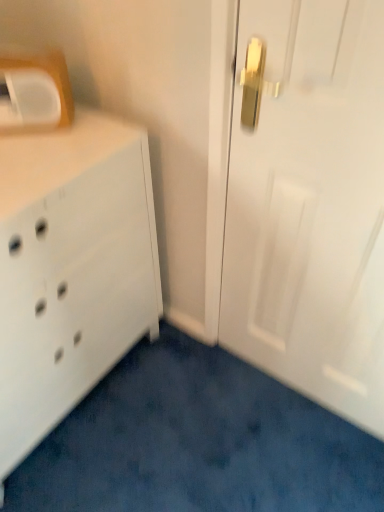
You are a GUI agent. You are given a task and a screenshot of the screen. Output one action in this format:
    pyautogui.click(x=<x>, y=<y>)
    Task: Click on the white plastic medicine cabinet at upper left
    The height and width of the screenshot is (512, 384).
    Given the screenshot: What is the action you would take?
    pyautogui.click(x=35, y=93)

At what (x,y) coordinates should I click in order to perform the action: click on white matte chest of drawers at left. Please return your answer as a coordinate pair (x, y). The image size is (384, 512). Looking at the image, I should click on (71, 269).

Image resolution: width=384 pixels, height=512 pixels. What are the coordinates of `door that is in front of the white matte chest of drawers at left` in the screenshot? It's located at (309, 202).

From the picture: Is white glossy door at center located outside white matte chest of drawers at left?

Absolutely, white glossy door at center is external to white matte chest of drawers at left.

Between white glossy door at center and white matte chest of drawers at left, which one is positioned behind?

Positioned behind is white matte chest of drawers at left.

Between white glossy door at center and white matte chest of drawers at left, which one appears on the left side from the viewer's perspective?

Positioned to the left is white matte chest of drawers at left.

In terms of width, does white glossy door at center look wider or thinner when compared to white plastic medicine cabinet at upper left?

In the image, white glossy door at center appears to be more narrow than white plastic medicine cabinet at upper left.

Does white glossy door at center have a greater height compared to white plastic medicine cabinet at upper left?

Yes, white glossy door at center is taller than white plastic medicine cabinet at upper left.

Based on the photo, how far apart are white glossy door at center and white plastic medicine cabinet at upper left?

A distance of 24.15 inches exists between white glossy door at center and white plastic medicine cabinet at upper left.

Is white matte chest of drawers at left touching white plastic medicine cabinet at upper left?

No, white matte chest of drawers at left is not making contact with white plastic medicine cabinet at upper left.

Is white matte chest of drawers at left facing towards white plastic medicine cabinet at upper left?

No, white matte chest of drawers at left is not facing towards white plastic medicine cabinet at upper left.

Can white plastic medicine cabinet at upper left be found inside white matte chest of drawers at left?

Definitely not — white plastic medicine cabinet at upper left is not inside white matte chest of drawers at left.

Between white plastic medicine cabinet at upper left and white matte chest of drawers at left, which one has larger width?

Wider between the two is white matte chest of drawers at left.

From a real-world perspective, who is located higher, white plastic medicine cabinet at upper left or white matte chest of drawers at left?

white plastic medicine cabinet at upper left.

Between white plastic medicine cabinet at upper left and white matte chest of drawers at left, which one appears on the right side from the viewer's perspective?

white plastic medicine cabinet at upper left.

Is white matte chest of drawers at left a part of white plastic medicine cabinet at upper left?

No, white matte chest of drawers at left is located outside of white plastic medicine cabinet at upper left.

Consider the image. Can you confirm if white plastic medicine cabinet at upper left is shorter than white glossy door at center?

Indeed, white plastic medicine cabinet at upper left has a lesser height compared to white glossy door at center.

From the image's perspective, is white plastic medicine cabinet at upper left on white glossy door at center?

Correct, white plastic medicine cabinet at upper left appears higher than white glossy door at center in the image.

Is the position of white plastic medicine cabinet at upper left more distant than that of white glossy door at center?

Yes, it is behind white glossy door at center.

Considering the sizes of objects white plastic medicine cabinet at upper left and white glossy door at center in the image provided, who is bigger, white plastic medicine cabinet at upper left or white glossy door at center?

Bigger between the two is white glossy door at center.

Looking at this image, is white matte chest of drawers at left oriented towards white glossy door at center?

Yes, white matte chest of drawers at left faces towards white glossy door at center.

Who is taller, white matte chest of drawers at left or white glossy door at center?

Standing taller between the two is white glossy door at center.

Is point (42, 324) farther from camera compared to point (298, 121)?

Yes, it is.

Based on the photo, how many degrees apart are the facing directions of white matte chest of drawers at left and white glossy door at center?

white matte chest of drawers at left and white glossy door at center are facing 89.9 degrees away from each other.

Find the location of `chest of drawers below the white glossy door at center (from the image's perspective)`. chest of drawers below the white glossy door at center (from the image's perspective) is located at coordinates (71, 269).

Where is `door beneath the white plastic medicine cabinet at upper left (from a real-world perspective)`? door beneath the white plastic medicine cabinet at upper left (from a real-world perspective) is located at coordinates (309, 202).

Estimate the real-world distances between objects in this image. Which object is further from white matte chest of drawers at left, white glossy door at center or white plastic medicine cabinet at upper left?

white glossy door at center.

Which object lies further to the anchor point white plastic medicine cabinet at upper left, white matte chest of drawers at left or white glossy door at center?

white glossy door at center.

In the scene shown: Considering their positions, is white glossy door at center positioned closer to white plastic medicine cabinet at upper left than white matte chest of drawers at left?

white matte chest of drawers at left is positioned closer to the anchor white plastic medicine cabinet at upper left.

Based on their spatial positions, is white matte chest of drawers at left or white plastic medicine cabinet at upper left closer to white glossy door at center?

white matte chest of drawers at left.

From the image, which object appears to be farther from white glossy door at center, white plastic medicine cabinet at upper left or white matte chest of drawers at left?

Based on the image, white plastic medicine cabinet at upper left appears to be further to white glossy door at center.

When comparing their distances from white matte chest of drawers at left, does white plastic medicine cabinet at upper left or white glossy door at center seem further?

Among the two, white glossy door at center is located further to white matte chest of drawers at left.

Locate an element on the screen. The width and height of the screenshot is (384, 512). medicine cabinet between white matte chest of drawers at left and white glossy door at center from left to right is located at coordinates (35, 93).